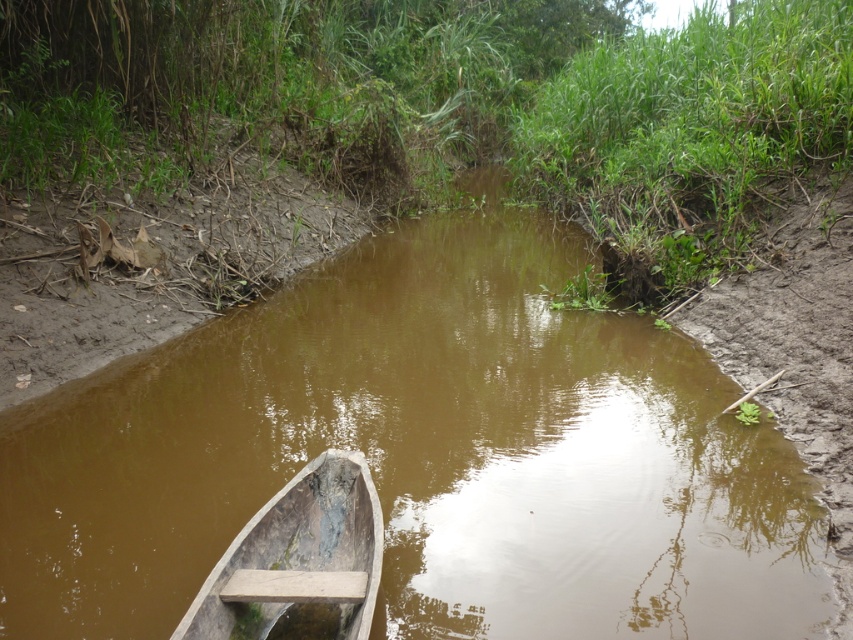
Question: Can you confirm if green grass at center is positioned below wooden boat at lower left?

Choices:
 (A) no
 (B) yes

Answer: (A)

Question: Which point appears farthest from the camera in this image?

Choices:
 (A) (368, 547)
 (B) (154, 120)
 (C) (404, 468)
 (D) (251, 576)

Answer: (B)

Question: Which is nearer to the brown muddy stream at center?

Choices:
 (A) green grass at center
 (B) wooden boat at lower left

Answer: (B)

Question: Does green grass at center appear over wooden boat at lower left?

Choices:
 (A) no
 (B) yes

Answer: (B)

Question: Which point appears closest to the camera in this image?

Choices:
 (A) (302, 577)
 (B) (399, 58)
 (C) (271, 396)
 (D) (332, 493)

Answer: (A)

Question: Is wooden boat at lower left bigger than wooden plank at lower left?

Choices:
 (A) yes
 (B) no

Answer: (A)